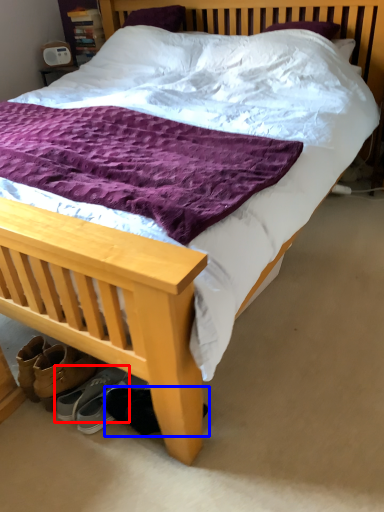
Question: Which object is closer to the camera taking this photo, footwear (highlighted by a red box) or footwear (highlighted by a blue box)?

Choices:
 (A) footwear
 (B) footwear

Answer: (B)